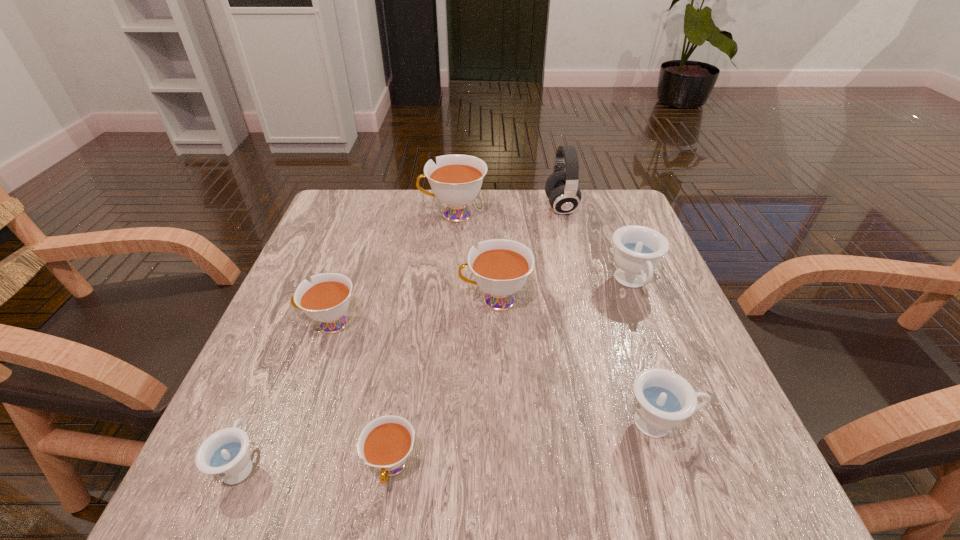
In order to click on free space located 0.090m on the ear cups of the tallest object in this screenshot , I will do `click(512, 207)`.

At what (x,y) coordinates should I click in order to perform the action: click on free region located on the ear cups of the tallest object. Please return your answer as a coordinate pair (x, y). The height and width of the screenshot is (540, 960). Looking at the image, I should click on (426, 207).

At what (x,y) coordinates should I click in order to perform the action: click on vacant space located 0.180m on the side of the biggest white teacup with the handle. Please return your answer as a coordinate pair (x, y). The height and width of the screenshot is (540, 960). Looking at the image, I should click on (351, 214).

Locate an element on the screen. free space located 0.100m on the side of the biggest white teacup with the handle is located at coordinates click(382, 214).

Locate an element on the screen. The height and width of the screenshot is (540, 960). free spot located 0.190m on the side of the biggest white teacup with the handle is located at coordinates (348, 214).

Where is `vacant space situated on the side of the second biggest white teacup with the handle`? The image size is (960, 540). vacant space situated on the side of the second biggest white teacup with the handle is located at coordinates (354, 300).

This screenshot has height=540, width=960. Find the location of `vacant space situated 0.130m on the side of the second biggest white teacup with the handle`. vacant space situated 0.130m on the side of the second biggest white teacup with the handle is located at coordinates pyautogui.click(x=396, y=300).

Where is `free space located 0.230m on the side of the second biggest white teacup with the handle`? free space located 0.230m on the side of the second biggest white teacup with the handle is located at coordinates (349, 300).

Find the location of a particular element. vacant area located on the side of the farthest blue teacup with the handle is located at coordinates (682, 410).

Find the location of a particular element. vacant region located on the side of the smallest blue teacup with the handle is located at coordinates (315, 287).